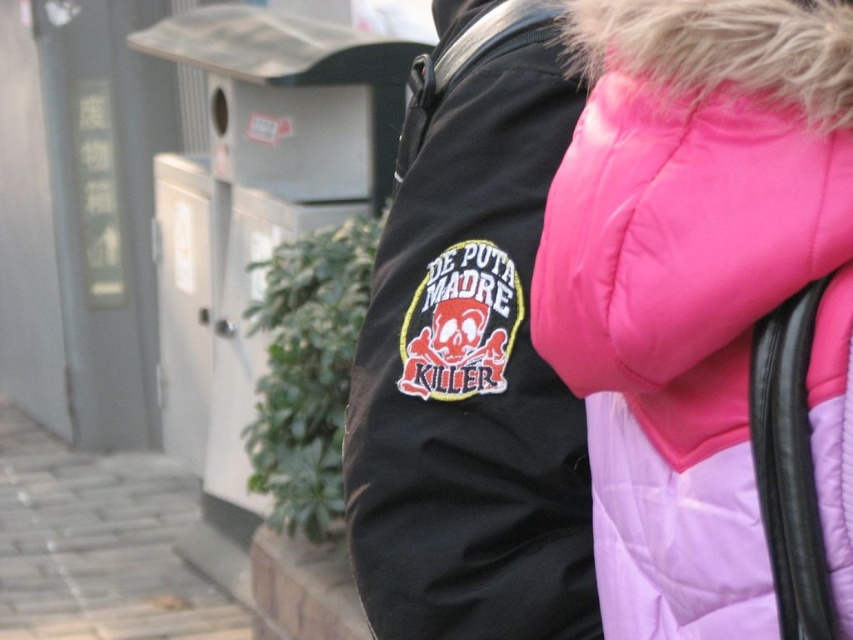
You are a photographer trying to capture a shot of the pink quilted jacket at upper right. The camera you are using has a focal length of 50mm. If you want to ensure the jacket fills the frame, which direction should you move relative to the jacket?

Since the pink quilted jacket at upper right is positioned at point (708, 310), you should move closer to the jacket to fill the frame, as the coordinates indicate it is relatively small in the current composition.

You are a photographer trying to capture a shot of the pink quilted jacket at upper right without including the gray brick pavement at lower left in the frame. Based on their positions, is this possible?

The pink quilted jacket at upper right is positioned over the gray brick pavement at lower left, so it is not possible to capture the jacket without including the pavement in the frame.